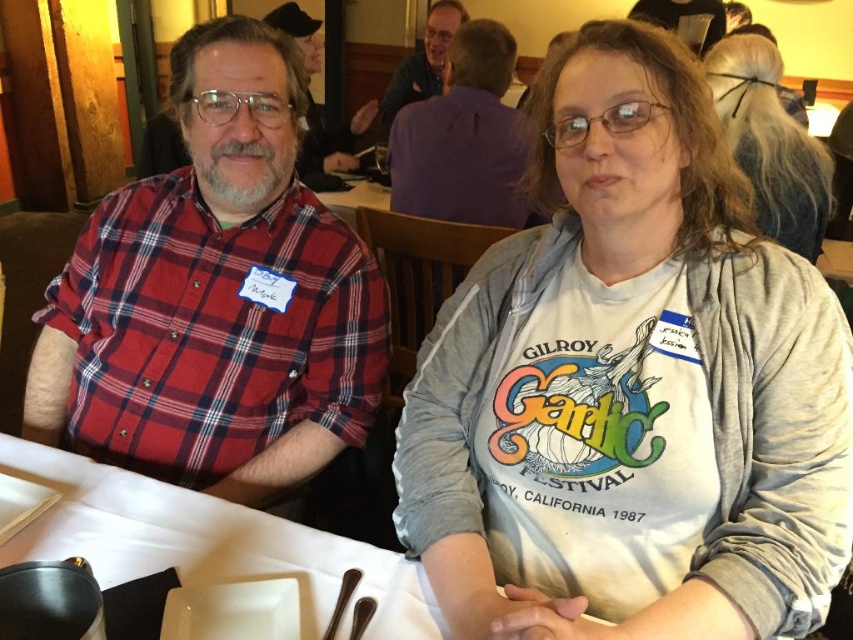
Question: Which point is closer to the camera?

Choices:
 (A) (463, 44)
 (B) (317, 122)

Answer: (A)

Question: Can you confirm if white ceramic plate at center is thinner than purple fabric shirt at upper center?

Choices:
 (A) no
 (B) yes

Answer: (A)

Question: Is gray cotton hoodie at center thinner than gray fleece jacket at upper center?

Choices:
 (A) yes
 (B) no

Answer: (B)

Question: Among these points, which one is farthest from the camera?

Choices:
 (A) (364, 618)
 (B) (422, 624)
 (C) (47, 333)

Answer: (C)

Question: Which object is positioned farthest from the polished metal spoon at lower center?

Choices:
 (A) purple fabric shirt at upper center
 (B) shiny metal spoon at lower center
 (C) gray cotton hoodie at center
 (D) white glossy plate at lower center

Answer: (A)

Question: Does gray cotton hoodie at center appear on the right side of gray fleece jacket at upper center?

Choices:
 (A) no
 (B) yes

Answer: (B)